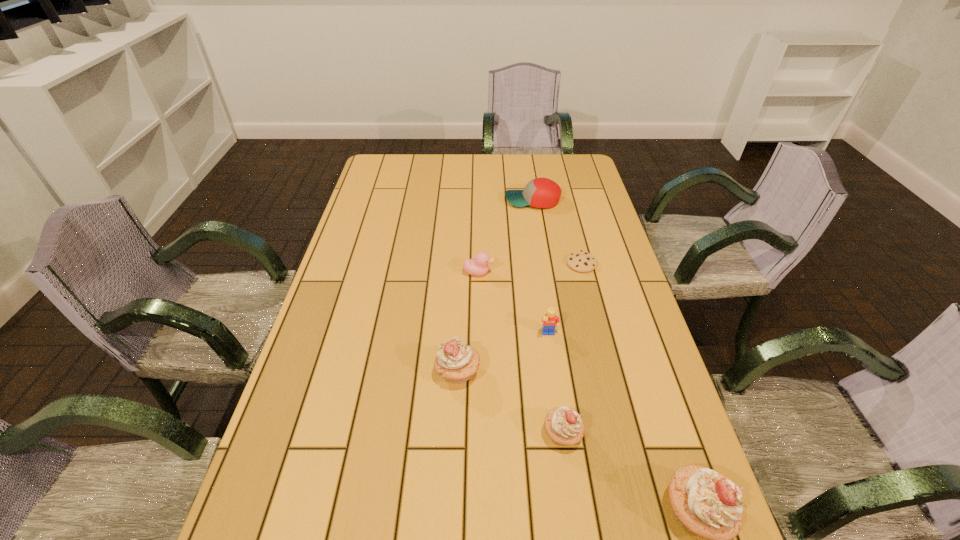
Find the location of a particular element. The image size is (960, 540). vacant space at the right edge of the desktop is located at coordinates (567, 195).

In the image, there is a desktop. Where is `vacant area at the far right corner`? This screenshot has height=540, width=960. vacant area at the far right corner is located at coordinates (585, 177).

This screenshot has width=960, height=540. I want to click on free space between the Lego and the sixth farthest object, so click(556, 384).

This screenshot has width=960, height=540. I want to click on empty location between the farthest cupcake and the shortest object, so 519,318.

I want to click on vacant space that is in between the Lego and the farthest cupcake, so click(x=503, y=354).

You are a GUI agent. You are given a task and a screenshot of the screen. Output one action in this format:
    pyautogui.click(x=<x>, y=<y>)
    Task: Click on the free space between the duckling and the shortest cupcake
    
    Given the screenshot: What is the action you would take?
    pyautogui.click(x=520, y=353)

Find the location of a particular element. The image size is (960, 540). vacant point located between the second cupcake from left to right and the sixth shortest object is located at coordinates (510, 403).

I want to click on free space that is in between the duckling and the farthest object, so click(x=506, y=237).

Locate which object is the second closest to the Lego. Please provide its 2D coordinates. Your answer should be formatted as a tuple, i.e. [(x, y)], where the tuple contains the x and y coordinates of a point satisfying the conditions above.

[(564, 426)]

Locate an element on the screen. The image size is (960, 540). object that stands as the fourth closest to the duckling is located at coordinates (540, 192).